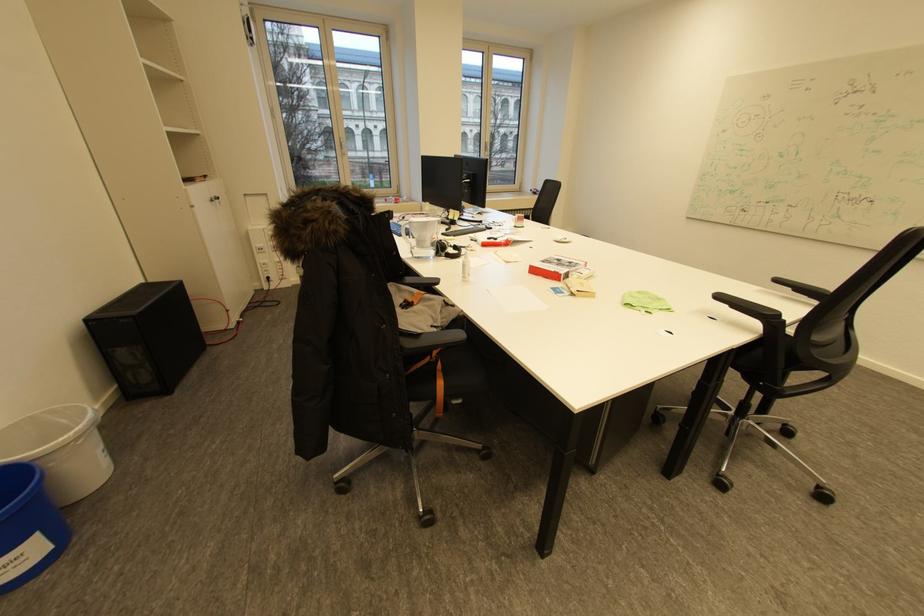
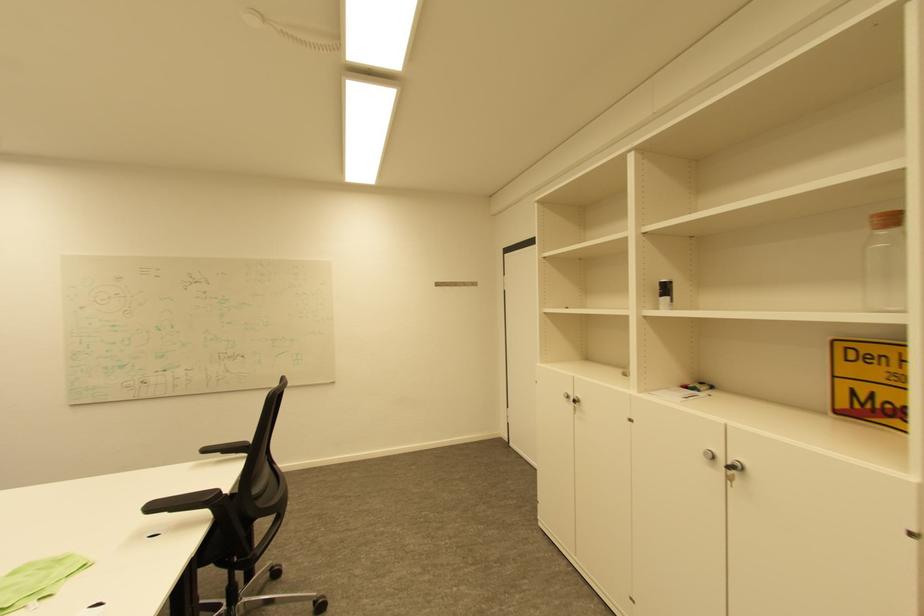
Question: The images are taken continuously from a first-person perspective. In which direction is your viewpoint rotating?

Choices:
 (A) Left
 (B) Right
 (C) Up
 (D) Down

Answer: (B)